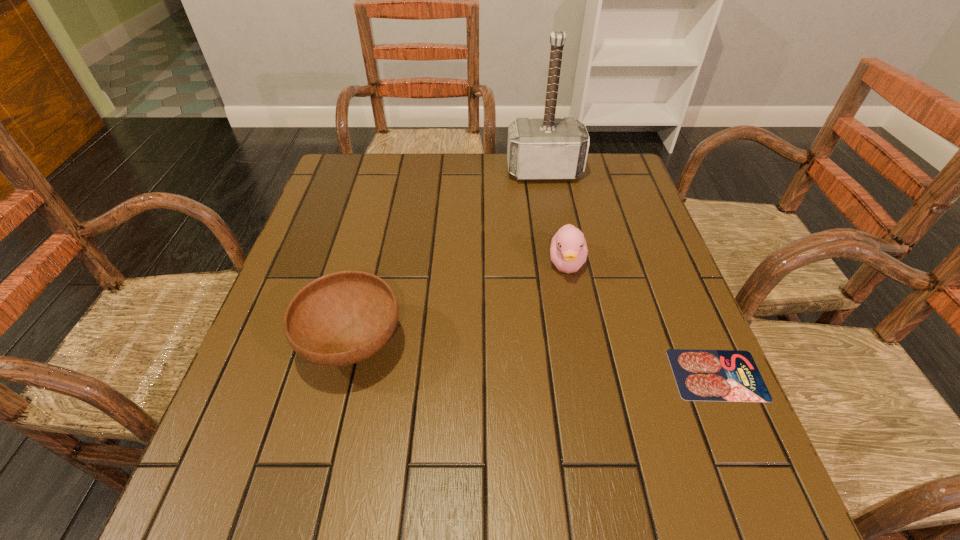
The image size is (960, 540). Find the location of `free space on the desktop that is between the bowl and the shortest object and is positioned on the front-facing side of the duckling`. free space on the desktop that is between the bowl and the shortest object and is positioned on the front-facing side of the duckling is located at coordinates (576, 363).

Locate an element on the screen. vacant spot on the desktop that is between the bowl and the rightmost object and is positioned for striking with the head of the farthest object is located at coordinates (584, 363).